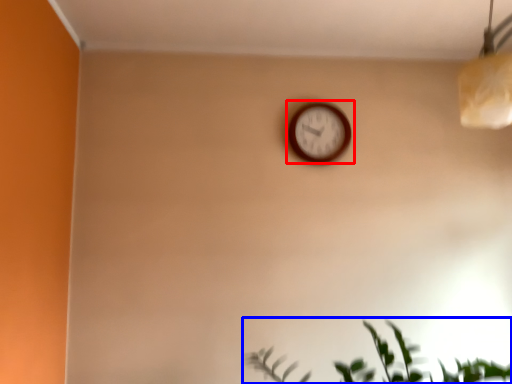
Question: Which object appears closest to the camera in this image, wall clock (highlighted by a red box) or houseplant (highlighted by a blue box)?

Choices:
 (A) wall clock
 (B) houseplant

Answer: (B)